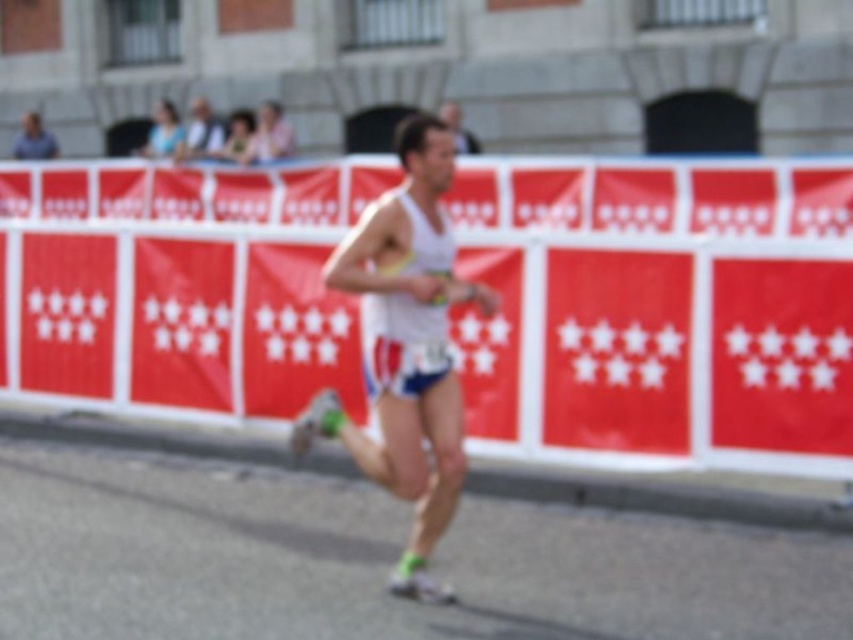
Does white fabric runner at center appear over matte blue tank top at upper left?

Incorrect, white fabric runner at center is not positioned above matte blue tank top at upper left.

Who is taller, white fabric runner at center or matte blue tank top at upper left?

With more height is white fabric runner at center.

Does point (357, 250) come closer to viewer compared to point (169, 100)?

Yes, it is in front of point (169, 100).

Locate an element on the screen. The height and width of the screenshot is (640, 853). white fabric runner at center is located at coordinates (405, 348).

From the picture: Is white fabric banner at center taller than matte blue tank top at upper left?

Correct, white fabric banner at center is much taller as matte blue tank top at upper left.

Does point (65, 220) come farther from viewer compared to point (163, 138)?

No, (65, 220) is in front of (163, 138).

Measure the distance between white fabric banner at center and camera.

They are 23.61 feet apart.

The image size is (853, 640). Identify the location of white fabric banner at center. (659, 310).

Can you confirm if white fabric banner at center is positioned to the right of white fabric runner at center?

Incorrect, white fabric banner at center is not on the right side of white fabric runner at center.

Which of these two, white fabric banner at center or white fabric runner at center, stands taller?

white fabric banner at center is taller.

This screenshot has height=640, width=853. In order to click on white fabric banner at center in this screenshot , I will do `click(659, 310)`.